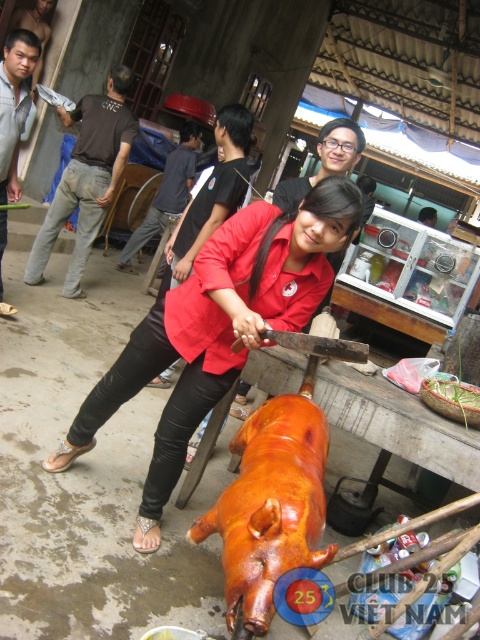
You are a tailor who needs to determine which jacket has a larger width to fit a customer with broader shoulders. Which jacket between the gray fleece jacket at upper left and the dark brown leather jacket at center should you choose?

The dark brown leather jacket at center has a larger width than the gray fleece jacket at upper left, so it is the better choice for a customer with broader shoulders.